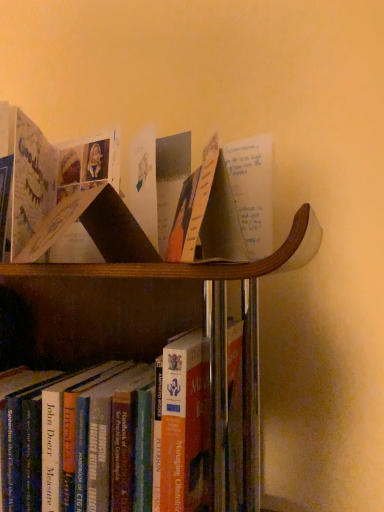
Question: Considering the relative positions of matte paper book at center and matte paper book at center, which is counted as the second book, starting from the bottom, in the image provided, is matte paper book at center in front of matte paper book at center, which is counted as the second book, starting from the bottom,?

Choices:
 (A) yes
 (B) no

Answer: (A)

Question: Is matte paper book at center oriented away from matte paper book at center, which is counted as the second book, starting from the bottom?

Choices:
 (A) yes
 (B) no

Answer: (B)

Question: Considering the relative sizes of matte paper book at center and matte paper book at center, which is counted as the second book, starting from the bottom, in the image provided, is matte paper book at center bigger than matte paper book at center, which is counted as the second book, starting from the bottom,?

Choices:
 (A) no
 (B) yes

Answer: (A)

Question: Can you confirm if matte paper book at center is positioned to the right of matte paper book at center, which is counted as the second book, starting from the bottom?

Choices:
 (A) no
 (B) yes

Answer: (B)

Question: Can you see matte paper book at center touching matte paper book at center, which is counted as the second book, starting from the bottom?

Choices:
 (A) yes
 (B) no

Answer: (B)

Question: Considering their positions, is hardcover book at lower center, which is the first book from bottom to top, located in front of or behind matte paper book at center, which is counted as the second book, starting from the bottom?

Choices:
 (A) front
 (B) behind

Answer: (A)

Question: Is hardcover book at lower center, which is the first book from bottom to top, taller or shorter than matte paper book at center, marked as the 1th book in a top-to-bottom arrangement?

Choices:
 (A) short
 (B) tall

Answer: (B)

Question: Would you say hardcover book at lower center, which is the first book from bottom to top, is to the left or to the right of matte paper book at center, marked as the 1th book in a top-to-bottom arrangement, in the picture?

Choices:
 (A) left
 (B) right

Answer: (A)

Question: From the image's perspective, is hardcover book at lower center, which is counted as the 2th book, starting from the top, above or below matte paper book at center, marked as the 1th book in a top-to-bottom arrangement?

Choices:
 (A) above
 (B) below

Answer: (B)

Question: From their relative heights in the image, would you say matte paper book at center is taller or shorter than matte paper book at center, marked as the 1th book in a top-to-bottom arrangement?

Choices:
 (A) short
 (B) tall

Answer: (B)

Question: From the image's perspective, is matte paper book at center positioned above or below matte paper book at center, which is counted as the second book, starting from the bottom?

Choices:
 (A) below
 (B) above

Answer: (B)

Question: Visually, is matte paper book at center positioned to the left or to the right of matte paper book at center, which is counted as the second book, starting from the bottom?

Choices:
 (A) right
 (B) left

Answer: (A)

Question: Does point (198, 222) appear closer or farther from the camera than point (29, 200)?

Choices:
 (A) closer
 (B) farther

Answer: (A)

Question: Is point pos(26,210) positioned closer to the camera than point pos(216,251)?

Choices:
 (A) closer
 (B) farther

Answer: (B)

Question: Considering the positions of matte paper book at center, marked as the 1th book in a top-to-bottom arrangement, and matte paper book at center in the image, is matte paper book at center, marked as the 1th book in a top-to-bottom arrangement, wider or thinner than matte paper book at center?

Choices:
 (A) wide
 (B) thin

Answer: (A)